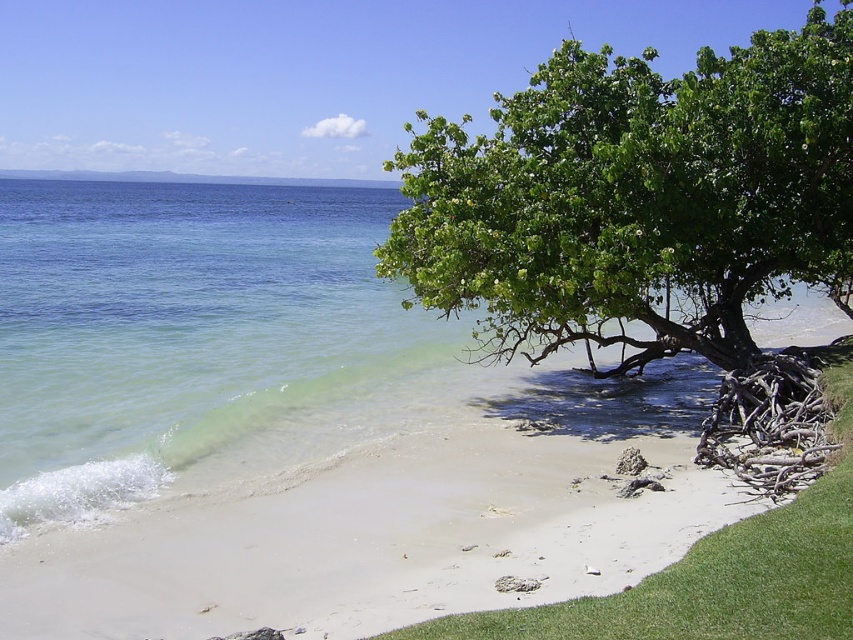
From the picture: You are standing on the beach and want to walk from the white sand at lower right to the green leafy tree at upper right. Which direction should you move to reach it?

Since the white sand at lower right is shorter than the green leafy tree at upper right, you should move towards the upper right direction to reach the tree.

You are standing on the beach and want to determine which area takes up more space in the image between the white sand at lower right and the green leafy tree at upper right. Based on the scene, which one covers a larger portion of the image?

The green leafy tree at upper right occupies more space in the image than the white sand at lower right.